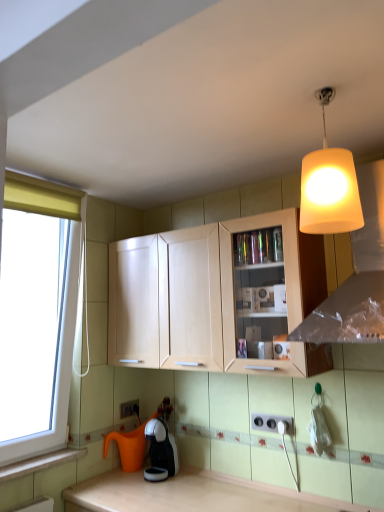
Question: Is matte white lampshade at upper right oriented towards white plastic electric outlet at lower center, marked as the 2th electric outlet in a front-to-back arrangement?

Choices:
 (A) yes
 (B) no

Answer: (B)

Question: Considering the relative sizes of matte white lampshade at upper right and white plastic electric outlet at lower center, the second electric outlet in the right-to-left sequence, in the image provided, is matte white lampshade at upper right taller than white plastic electric outlet at lower center, the second electric outlet in the right-to-left sequence,?

Choices:
 (A) no
 (B) yes

Answer: (B)

Question: Is matte white lampshade at upper right at the left side of white plastic electric outlet at lower center, marked as the 2th electric outlet in a front-to-back arrangement?

Choices:
 (A) no
 (B) yes

Answer: (A)

Question: Considering the relative positions of matte white lampshade at upper right and white plastic electric outlet at lower center, marked as the 2th electric outlet in a front-to-back arrangement, in the image provided, is matte white lampshade at upper right in front of white plastic electric outlet at lower center, marked as the 2th electric outlet in a front-to-back arrangement,?

Choices:
 (A) no
 (B) yes

Answer: (B)

Question: Is the surface of matte white lampshade at upper right in direct contact with white plastic electric outlet at lower center, the second electric outlet in the right-to-left sequence?

Choices:
 (A) no
 (B) yes

Answer: (A)

Question: From the image's perspective, relative to wooden at lower left, is white plastic electric outlet at lower center, marked as the 2th electric outlet in a front-to-back arrangement, above or below?

Choices:
 (A) above
 (B) below

Answer: (A)

Question: Visually, is white plastic electric outlet at lower center, the second electric outlet in the right-to-left sequence, positioned to the left or to the right of wooden at lower left?

Choices:
 (A) left
 (B) right

Answer: (B)

Question: Is point (130, 401) positioned closer to the camera than point (34, 463)?

Choices:
 (A) farther
 (B) closer

Answer: (A)

Question: Which is correct: white plastic electric outlet at lower center, the second electric outlet in the right-to-left sequence, is inside wooden at lower left, or outside of it?

Choices:
 (A) inside
 (B) outside

Answer: (B)

Question: Is point (312, 252) closer or farther from the camera than point (291, 430)?

Choices:
 (A) farther
 (B) closer

Answer: (B)

Question: From a real-world perspective, is light wood cabinet at center physically located above or below white plastic electric outlet at lower center, which is the 1th electric outlet from front to back?

Choices:
 (A) below
 (B) above

Answer: (B)

Question: From the image's perspective, is light wood cabinet at center located above or below white plastic electric outlet at lower center, which is counted as the second electric outlet, starting from the back?

Choices:
 (A) below
 (B) above

Answer: (B)

Question: Considering the positions of light wood cabinet at center and white plastic electric outlet at lower center, the 1th electric outlet from the top, in the image, is light wood cabinet at center taller or shorter than white plastic electric outlet at lower center, the 1th electric outlet from the top,?

Choices:
 (A) tall
 (B) short

Answer: (A)

Question: Is matte white lampshade at upper right bigger or smaller than white plastic electric outlet at lower center, acting as the second electric outlet starting from the left?

Choices:
 (A) small
 (B) big

Answer: (B)

Question: From a real-world perspective, is matte white lampshade at upper right positioned above or below white plastic electric outlet at lower center, the 1th electric outlet from the top?

Choices:
 (A) above
 (B) below

Answer: (A)